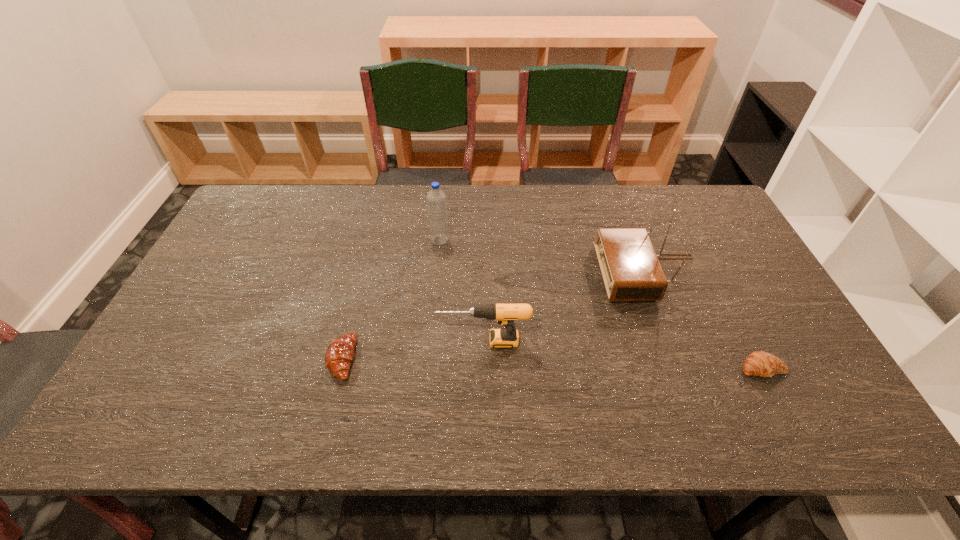
Find the location of a particular element. radio_receiver is located at coordinates (631, 271).

Find the location of `water bottle`. water bottle is located at coordinates (436, 199).

Locate an element on the screen. The width and height of the screenshot is (960, 540). the third shortest object is located at coordinates (505, 314).

The width and height of the screenshot is (960, 540). What are the coordinates of `the leftmost object` in the screenshot? It's located at (339, 354).

Where is `the right crescent roll`? Image resolution: width=960 pixels, height=540 pixels. the right crescent roll is located at coordinates (759, 363).

The image size is (960, 540). I want to click on free space located on the front panel of the radio_receiver, so click(500, 272).

Find the location of a particular element. free space located 0.110m on the front panel of the radio_receiver is located at coordinates (562, 272).

Identify the location of vacant space located 0.190m on the front panel of the radio_receiver. The width and height of the screenshot is (960, 540). (534, 272).

Locate an element on the screen. vacant space located on the left of the water bottle is located at coordinates (393, 240).

The height and width of the screenshot is (540, 960). In order to click on free spot located on the handle side of the drill in this screenshot , I will do `click(303, 341)`.